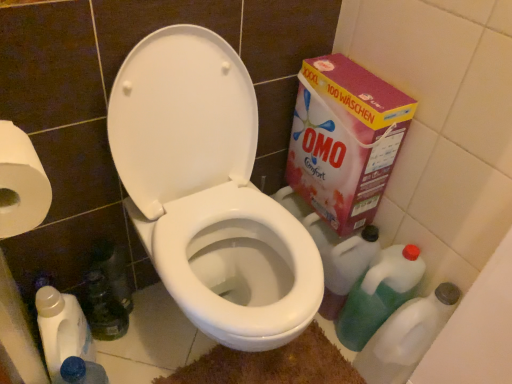
Question: From a real-world perspective, is white glossy toilet at center located beneath green plastic cleaner at lower right, which is counted as the first cleaning product, starting from the right?

Choices:
 (A) no
 (B) yes

Answer: (A)

Question: Is the depth of white glossy toilet at center less than that of green plastic cleaner at lower right, which is counted as the first cleaning product, starting from the right?

Choices:
 (A) yes
 (B) no

Answer: (A)

Question: Is white glossy toilet at center to the right of green plastic cleaner at lower right, which is counted as the first cleaning product, starting from the right, from the viewer's perspective?

Choices:
 (A) yes
 (B) no

Answer: (B)

Question: Considering the relative sizes of white glossy toilet at center and green plastic cleaner at lower right, which is counted as the first cleaning product, starting from the right, in the image provided, is white glossy toilet at center thinner than green plastic cleaner at lower right, which is counted as the first cleaning product, starting from the right,?

Choices:
 (A) no
 (B) yes

Answer: (A)

Question: Does white glossy toilet at center appear on the left side of green plastic cleaner at lower right, placed as the 4th cleaning product when sorted from left to right?

Choices:
 (A) yes
 (B) no

Answer: (A)

Question: Based on their positions, is brown textured bath mat at lower center located to the left or right of green plastic cleaner at lower right, placed as the 4th cleaning product when sorted from left to right?

Choices:
 (A) left
 (B) right

Answer: (A)

Question: From a real-world perspective, is brown textured bath mat at lower center positioned above or below green plastic cleaner at lower right, which is counted as the first cleaning product, starting from the right?

Choices:
 (A) below
 (B) above

Answer: (A)

Question: Is brown textured bath mat at lower center taller or shorter than green plastic cleaner at lower right, placed as the 4th cleaning product when sorted from left to right?

Choices:
 (A) short
 (B) tall

Answer: (A)

Question: Is point (337, 380) positioned closer to the camera than point (419, 301)?

Choices:
 (A) farther
 (B) closer

Answer: (A)

Question: In terms of width, does translucent plastic bottle at lower left look wider or thinner when compared to white paper at left?

Choices:
 (A) thin
 (B) wide

Answer: (A)

Question: Considering their positions, is translucent plastic bottle at lower left located in front of or behind white paper at left?

Choices:
 (A) front
 (B) behind

Answer: (B)

Question: Is point (95, 299) closer or farther from the camera than point (9, 122)?

Choices:
 (A) closer
 (B) farther

Answer: (B)

Question: In terms of size, does translucent plastic bottle at lower left appear bigger or smaller than white paper at left?

Choices:
 (A) big
 (B) small

Answer: (B)

Question: Relative to green translucent bottle at lower right, placed as the 3th cleaning product when sorted from left to right, is pink cardboard box at right in front or behind?

Choices:
 (A) behind
 (B) front

Answer: (B)

Question: Is point (315, 139) closer or farther from the camera than point (389, 309)?

Choices:
 (A) closer
 (B) farther

Answer: (B)